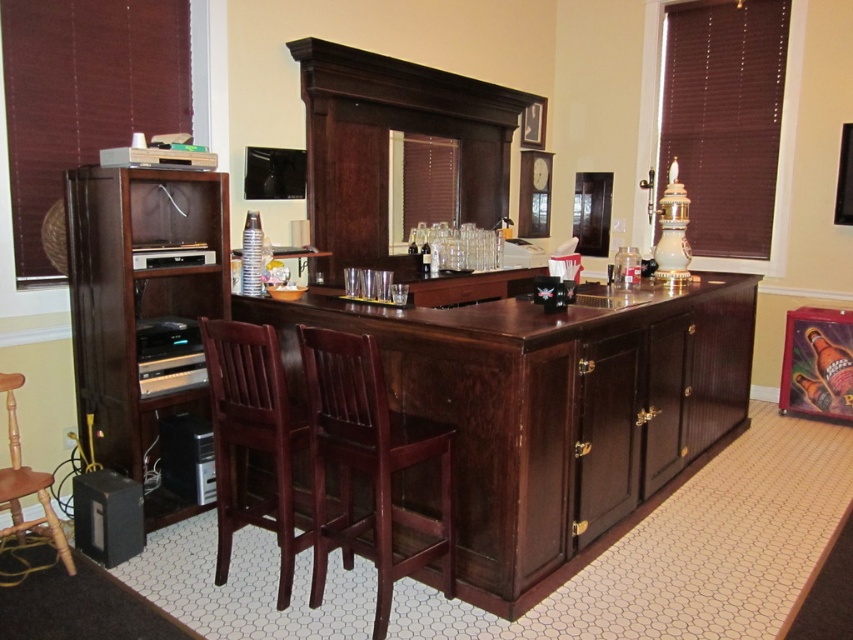
Can you confirm if light brown wood bar stool at lower left is wider than dark wood drawer at center?

No.

Based on the photo, can you confirm if light brown wood bar stool at lower left is bigger than dark wood drawer at center?

Correct, light brown wood bar stool at lower left is larger in size than dark wood drawer at center.

Identify the location of light brown wood bar stool at lower left. (26, 486).

Is dark wood bar at center taller than dark wood drawer at center?

Yes.

Between point (425, 579) and point (440, 292), which one is positioned in front?

Positioned in front is point (425, 579).

Describe the element at coordinates (554, 410) in the screenshot. Image resolution: width=853 pixels, height=640 pixels. I see `dark wood bar at center` at that location.

Image resolution: width=853 pixels, height=640 pixels. I want to click on dark wood bar at center, so click(x=554, y=410).

Does point (444, 289) lie in front of point (836, 346)?

Yes, it is.

Describe the element at coordinates (457, 289) in the screenshot. The image size is (853, 640). I see `dark wood drawer at center` at that location.

At what (x,y) coordinates should I click in order to perform the action: click on dark wood drawer at center. Please return your answer as a coordinate pair (x, y). Looking at the image, I should click on (457, 289).